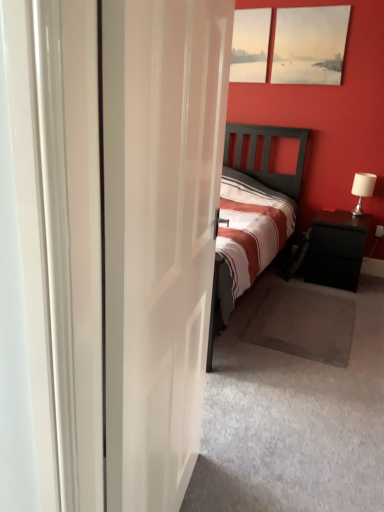
Question: From a real-world perspective, is black matte nightstand at right beneath matte wooden picture frame at upper center, which ranks as the second picture frame in right-to-left order?

Choices:
 (A) yes
 (B) no

Answer: (A)

Question: Would you say black matte nightstand at right is outside matte wooden picture frame at upper center, the 1th picture frame from the left?

Choices:
 (A) yes
 (B) no

Answer: (A)

Question: Is black matte nightstand at right further to the viewer compared to matte wooden picture frame at upper center, the 1th picture frame from the left?

Choices:
 (A) yes
 (B) no

Answer: (B)

Question: Is black matte nightstand at right turned away from matte wooden picture frame at upper center, the 1th picture frame from the left?

Choices:
 (A) yes
 (B) no

Answer: (B)

Question: Is black matte nightstand at right not near matte wooden picture frame at upper center, the 1th picture frame from the left?

Choices:
 (A) yes
 (B) no

Answer: (A)

Question: Relative to matte canvas painting at upper right, which appears as the second picture frame when viewed from the left, is white glossy door at center in front or behind?

Choices:
 (A) behind
 (B) front

Answer: (B)

Question: Looking at the image, does white glossy door at center seem bigger or smaller compared to matte canvas painting at upper right, the 1th picture frame positioned from the right?

Choices:
 (A) big
 (B) small

Answer: (A)

Question: Considering the positions of white glossy door at center and matte canvas painting at upper right, which appears as the second picture frame when viewed from the left, in the image, is white glossy door at center wider or thinner than matte canvas painting at upper right, which appears as the second picture frame when viewed from the left,?

Choices:
 (A) wide
 (B) thin

Answer: (A)

Question: Do you think white glossy door at center is within matte canvas painting at upper right, the 1th picture frame positioned from the right, or outside of it?

Choices:
 (A) outside
 (B) inside

Answer: (A)

Question: Based on their positions, is matte wooden picture frame at upper center, the 1th picture frame from the left, located to the left or right of matte canvas painting at upper right, which appears as the second picture frame when viewed from the left?

Choices:
 (A) left
 (B) right

Answer: (A)

Question: Is matte wooden picture frame at upper center, the 1th picture frame from the left, in front of or behind matte canvas painting at upper right, which appears as the second picture frame when viewed from the left, in the image?

Choices:
 (A) behind
 (B) front

Answer: (A)

Question: From their relative heights in the image, would you say matte wooden picture frame at upper center, which ranks as the second picture frame in right-to-left order, is taller or shorter than matte canvas painting at upper right, which appears as the second picture frame when viewed from the left?

Choices:
 (A) short
 (B) tall

Answer: (A)

Question: Is matte wooden picture frame at upper center, which ranks as the second picture frame in right-to-left order, bigger or smaller than matte canvas painting at upper right, which appears as the second picture frame when viewed from the left?

Choices:
 (A) small
 (B) big

Answer: (A)

Question: Considering the relative positions of matte canvas painting at upper right, which appears as the second picture frame when viewed from the left, and matte wooden picture frame at upper center, the 1th picture frame from the left, in the image provided, is matte canvas painting at upper right, which appears as the second picture frame when viewed from the left, to the left or to the right of matte wooden picture frame at upper center, the 1th picture frame from the left,?

Choices:
 (A) right
 (B) left

Answer: (A)

Question: Considering the positions of matte canvas painting at upper right, which appears as the second picture frame when viewed from the left, and matte wooden picture frame at upper center, which ranks as the second picture frame in right-to-left order, in the image, is matte canvas painting at upper right, which appears as the second picture frame when viewed from the left, bigger or smaller than matte wooden picture frame at upper center, which ranks as the second picture frame in right-to-left order,?

Choices:
 (A) big
 (B) small

Answer: (A)